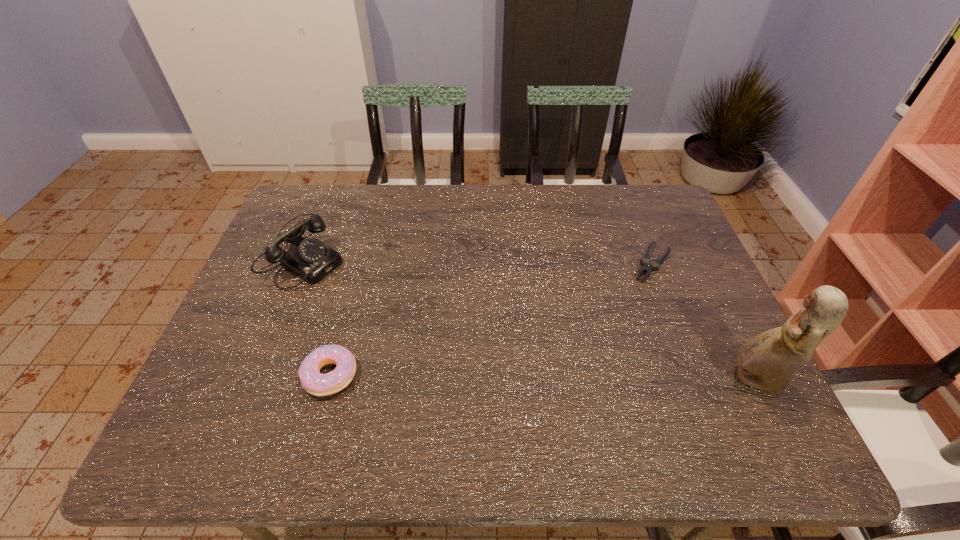
Locate an element on the screen. free space on the desktop that is between the second shortest object and the figurine and is positioned at the gripping part of the shortest object is located at coordinates (579, 379).

At what (x,y) coordinates should I click in order to perform the action: click on vacant space on the desktop that is between the doughnut and the rightmost object and is positioned on the front-facing side of the telephone. Please return your answer as a coordinate pair (x, y). Looking at the image, I should click on (538, 378).